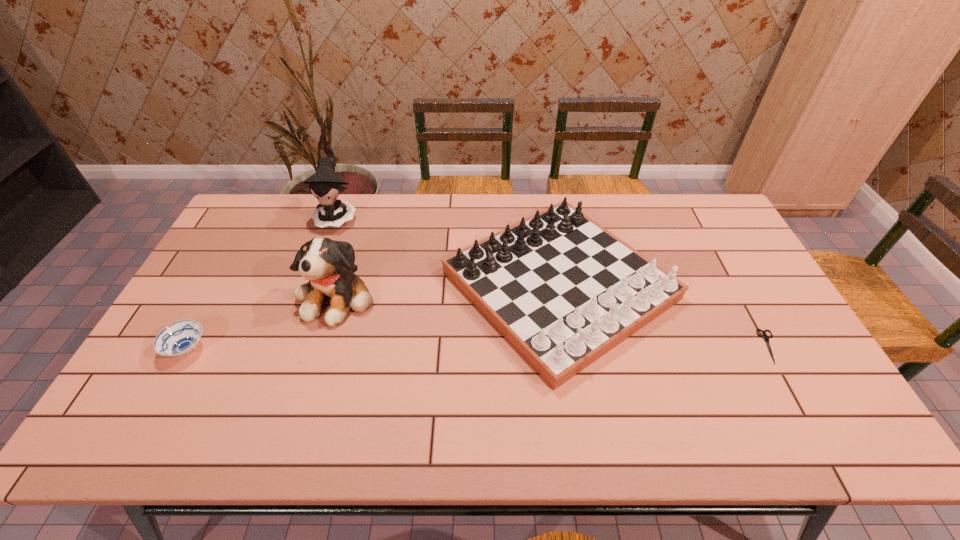
Locate an element on the screen. vacant space at the right edge is located at coordinates (773, 362).

Locate an element on the screen. vacant space at the far left corner of the desktop is located at coordinates (243, 222).

At what (x,y) coordinates should I click in order to perform the action: click on blank space at the far right corner of the desktop. Please return your answer as a coordinate pair (x, y). Image resolution: width=960 pixels, height=540 pixels. Looking at the image, I should click on (708, 218).

Locate an element on the screen. The image size is (960, 540). free space between the puppy and the fourth object from left to right is located at coordinates (448, 291).

The image size is (960, 540). Identify the location of vacant region between the gameboard and the puppy. (448, 291).

The image size is (960, 540). Find the location of `blank region between the second object from right to left and the soup bowl`. blank region between the second object from right to left and the soup bowl is located at coordinates (373, 317).

The width and height of the screenshot is (960, 540). I want to click on vacant space that is in between the puppy and the leftmost object, so click(x=262, y=322).

Locate an element on the screen. The image size is (960, 540). vacant space that's between the third shortest object and the soup bowl is located at coordinates (373, 317).

Identify the location of vacant space that's between the doll and the fourth object from left to right. (448, 251).

Where is `vacant region between the doll and the third shortest object`? vacant region between the doll and the third shortest object is located at coordinates (448, 251).